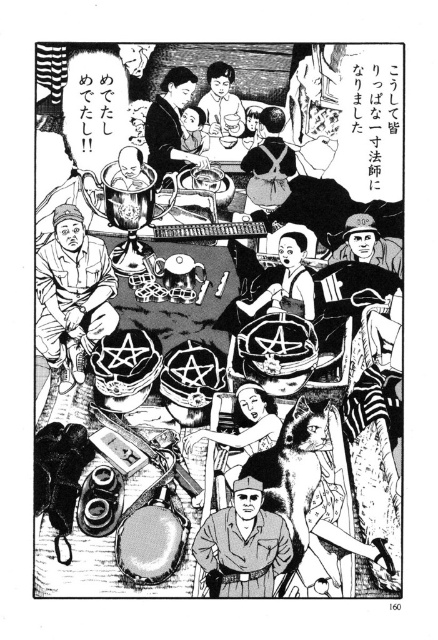
Does matte black helmet at center have a greater width compared to matte olive green uniform at center?

Yes.

Is point (38, 502) closer to camera compared to point (261, 557)?

No, it is not.

Identify the location of matte black helmet at center. The height and width of the screenshot is (640, 438). (216, 332).

Consider the image. Who is positioned more to the left, smooth black hair at center or matte black apron at center?

smooth black hair at center is more to the left.

Based on the photo, is smooth black hair at center thinner than matte black apron at center?

Yes, smooth black hair at center is thinner than matte black apron at center.

Where is `smooth black hair at center`? Image resolution: width=438 pixels, height=640 pixels. smooth black hair at center is located at coordinates (170, 124).

Locate an element on the screen. smooth black hair at center is located at coordinates (170, 124).

Is matte olive green uniform at center taller than matte black backpack at upper center?

Yes.

Who is shorter, matte olive green uniform at center or matte black backpack at upper center?

matte black backpack at upper center is shorter.

Is point (255, 532) in front of point (264, 200)?

That is True.

You are a GUI agent. You are given a task and a screenshot of the screen. Output one action in this format:
    pyautogui.click(x=<x>, y=<y>)
    Task: Click on the matte olive green uniform at center
    
    Given the screenshot: What is the action you would take?
    pyautogui.click(x=243, y=545)